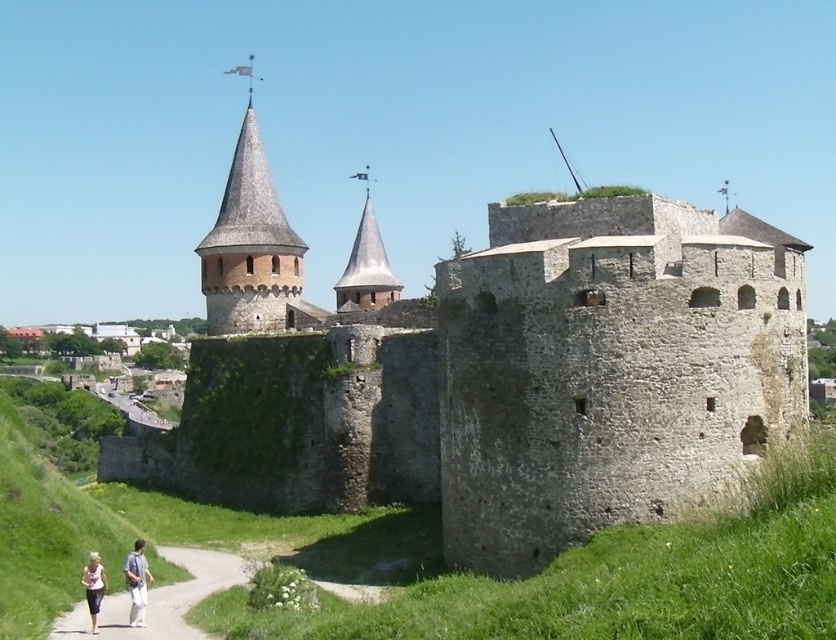
Question: From the image, what is the correct spatial relationship of smooth stone tower at upper center in relation to light pink fabric couple at lower left?

Choices:
 (A) below
 (B) above

Answer: (B)

Question: Estimate the real-world distances between objects in this image. Which object is farther from the light pink fabric at lower left?

Choices:
 (A) light blue cotton shirt at lower left
 (B) gravel path at lower left

Answer: (B)

Question: Which point is closer to the camera?

Choices:
 (A) (253, 211)
 (B) (84, 584)

Answer: (B)

Question: Which object is positioned farthest from the stone wall at center?

Choices:
 (A) smooth stone tower at upper center
 (B) light blue cotton shirt at lower left
 (C) gravel path at lower left
 (D) light pink fabric at lower left

Answer: (A)

Question: Is smooth gray stone tower at center below light pink fabric at lower left?

Choices:
 (A) yes
 (B) no

Answer: (B)

Question: Is light pink fabric couple at lower left wider than light pink fabric at lower left?

Choices:
 (A) yes
 (B) no

Answer: (A)